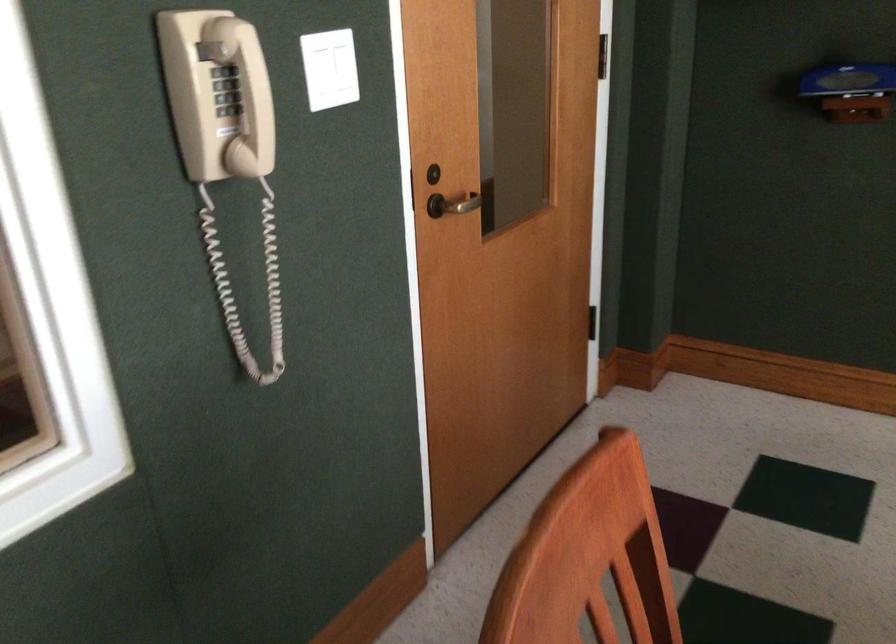
The width and height of the screenshot is (896, 644). What are the coordinates of `metal door handle` in the screenshot? It's located at (458, 204).